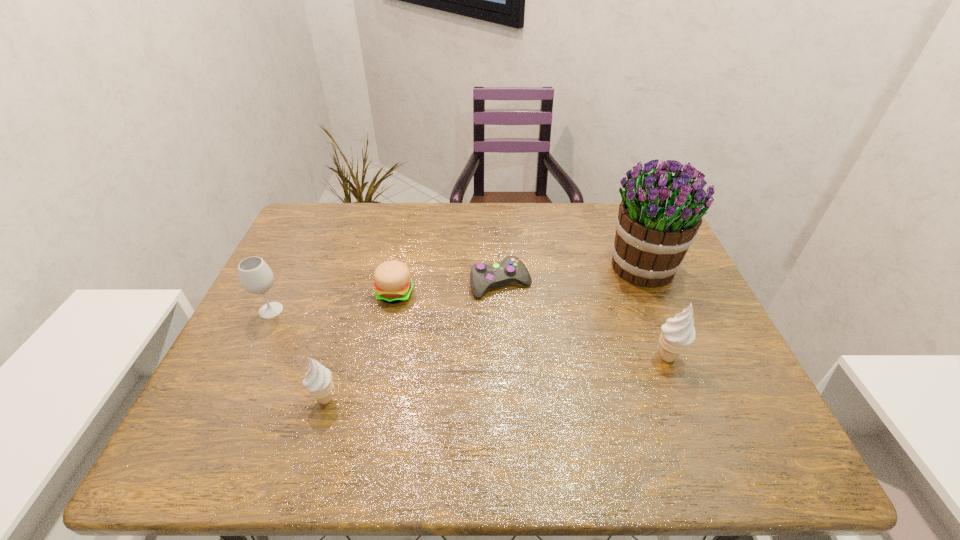
Locate an element on the screen. This screenshot has width=960, height=540. object at the left edge is located at coordinates (255, 276).

I want to click on icecream situated at the right edge, so click(x=677, y=334).

The image size is (960, 540). What are the coordinates of `bouquet located at the right edge` in the screenshot? It's located at (657, 222).

Locate an element on the screen. This screenshot has width=960, height=540. object that is at the far right corner is located at coordinates (657, 222).

At what (x,y) coordinates should I click in order to perform the action: click on vacant area at the far edge of the desktop. Please return your answer as a coordinate pair (x, y). Image resolution: width=960 pixels, height=540 pixels. Looking at the image, I should click on (454, 234).

Locate an element on the screen. vacant space at the near edge of the desktop is located at coordinates pyautogui.click(x=373, y=403).

Identify the location of vacant space at the left edge of the desktop. (257, 326).

What are the coordinates of `vacant space at the far left corner` in the screenshot? It's located at (310, 215).

In the image, there is a desktop. Identify the location of vacant space at the far right corner. The height and width of the screenshot is (540, 960). (613, 225).

This screenshot has height=540, width=960. Find the location of `free space that is in between the second nearest object and the shorter icecream`. free space that is in between the second nearest object and the shorter icecream is located at coordinates (496, 378).